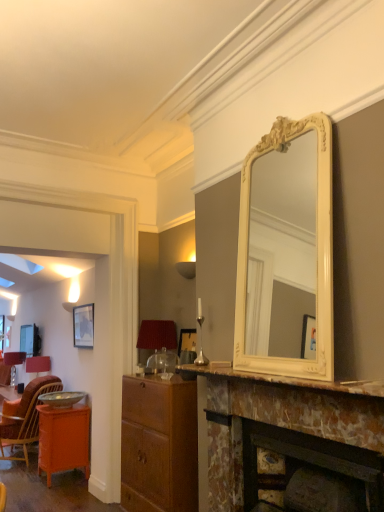
Question: Is matte red lampshade at left, marked as the second lamp in a front-to-back arrangement, facing away from wooden cabinet at center?

Choices:
 (A) no
 (B) yes

Answer: (A)

Question: Is matte red lampshade at left, the 2th lamp in the right-to-left sequence, bigger than wooden cabinet at center?

Choices:
 (A) no
 (B) yes

Answer: (A)

Question: Is matte red lampshade at left, the 1th lamp in the left-to-right sequence, located outside wooden cabinet at center?

Choices:
 (A) yes
 (B) no

Answer: (A)

Question: Is matte red lampshade at left, the first lamp from the back, beside wooden cabinet at center?

Choices:
 (A) no
 (B) yes

Answer: (A)

Question: From the image's perspective, is orange glossy cabinet at lower left located above or below marble/marbled fireplace at center?

Choices:
 (A) above
 (B) below

Answer: (B)

Question: Considering the positions of orange glossy cabinet at lower left and marble/marbled fireplace at center in the image, is orange glossy cabinet at lower left taller or shorter than marble/marbled fireplace at center?

Choices:
 (A) tall
 (B) short

Answer: (A)

Question: Is orange glossy cabinet at lower left bigger or smaller than marble/marbled fireplace at center?

Choices:
 (A) big
 (B) small

Answer: (A)

Question: From a real-world perspective, relative to marble/marbled fireplace at center, is orange glossy cabinet at lower left vertically above or below?

Choices:
 (A) above
 (B) below

Answer: (B)

Question: From a real-world perspective, is orange wicker chair at lower left positioned above or below matte red lampshade at center, arranged as the second lamp when ordered from the bottom?

Choices:
 (A) below
 (B) above

Answer: (A)

Question: In terms of size, does orange wicker chair at lower left appear bigger or smaller than matte red lampshade at center, the first lamp positioned from the top?

Choices:
 (A) big
 (B) small

Answer: (A)

Question: From the image's perspective, relative to matte red lampshade at center, arranged as the second lamp when ordered from the bottom, is orange wicker chair at lower left above or below?

Choices:
 (A) above
 (B) below

Answer: (B)

Question: Would you say orange wicker chair at lower left is to the left or to the right of matte red lampshade at center, arranged as the second lamp when viewed from the left, in the picture?

Choices:
 (A) left
 (B) right

Answer: (A)

Question: Considering the positions of point (150, 496) and point (165, 333), is point (150, 496) closer or farther from the camera than point (165, 333)?

Choices:
 (A) closer
 (B) farther

Answer: (A)

Question: Which is correct: wooden cabinet at center is inside matte red lampshade at center, which is counted as the first lamp, starting from the right, or outside of it?

Choices:
 (A) inside
 (B) outside

Answer: (B)